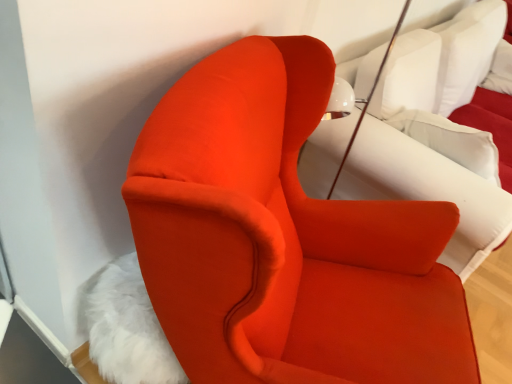
Question: From their relative heights in the image, would you say white fluffy rug at lower left is taller or shorter than white soft pillow at upper right?

Choices:
 (A) tall
 (B) short

Answer: (B)

Question: In terms of width, does white fluffy rug at lower left look wider or thinner when compared to white soft pillow at upper right?

Choices:
 (A) wide
 (B) thin

Answer: (A)

Question: Which of these objects is positioned farthest from the white fluffy rug at lower left?

Choices:
 (A) white soft pillow at upper right
 (B) velvet white bed at center
 (C) matte orange armchair at center

Answer: (A)

Question: Based on their relative distances, which object is farther from the white fluffy rug at lower left?

Choices:
 (A) velvet white bed at center
 (B) white soft pillow at upper right
 (C) matte orange armchair at center

Answer: (B)